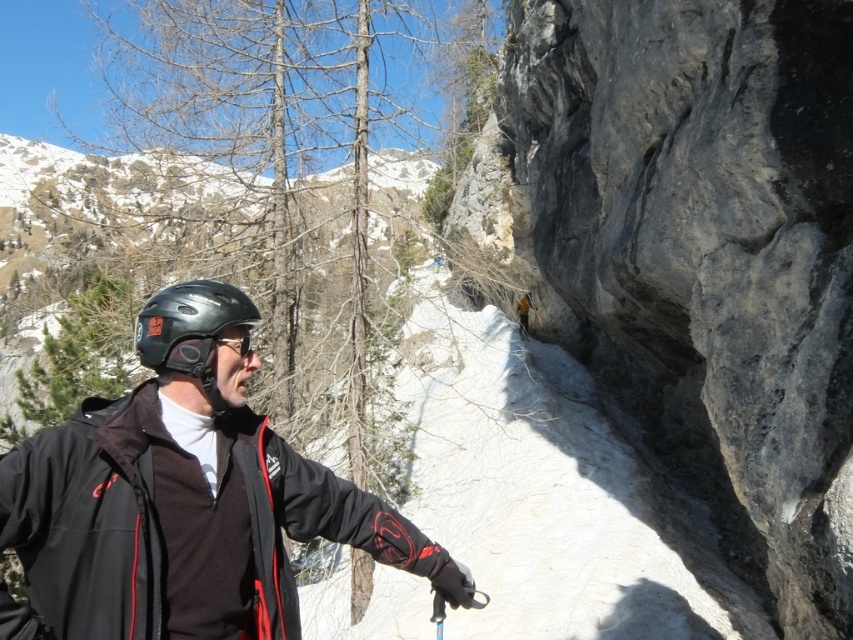
You are a photographer trying to capture a closeup of the matte black helmet at left and the matte black goggles at center. Your camera has a maximum focus range of 20 inches. Can you fit both objects in the frame without moving the camera?

The matte black helmet at left and matte black goggles at center are 22.49 inches apart, which exceeds the camera maximum focus range of 20 inches. Therefore, you cannot fit both objects in the frame without moving the camera.

You are a photographer trying to capture the scene of the person in the mountain. You notice the matte black helmet at left and the matte black goggles at center. Which object is positioned higher in the image?

The matte black helmet at left is positioned higher in the image than the matte black goggles at center.

You are an outdoor adventurer who wants to place a small flag on the highest point between the white powdery snow at center and the matte black goggles at center. According to the scene, which object should you place the flag on?

The white powdery snow at center is located above the matte black goggles at center, so you should place the flag on the white powdery snow at center since it is higher.